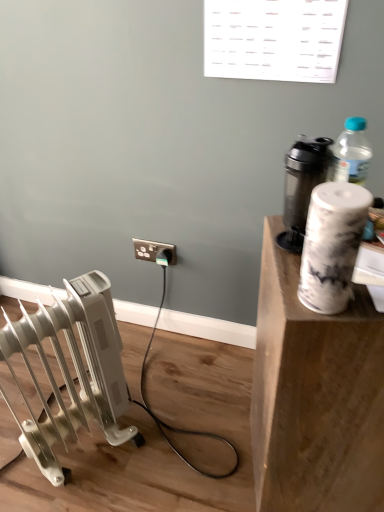
Identify the location of free space to the left of white marble cup at upper right. (201, 452).